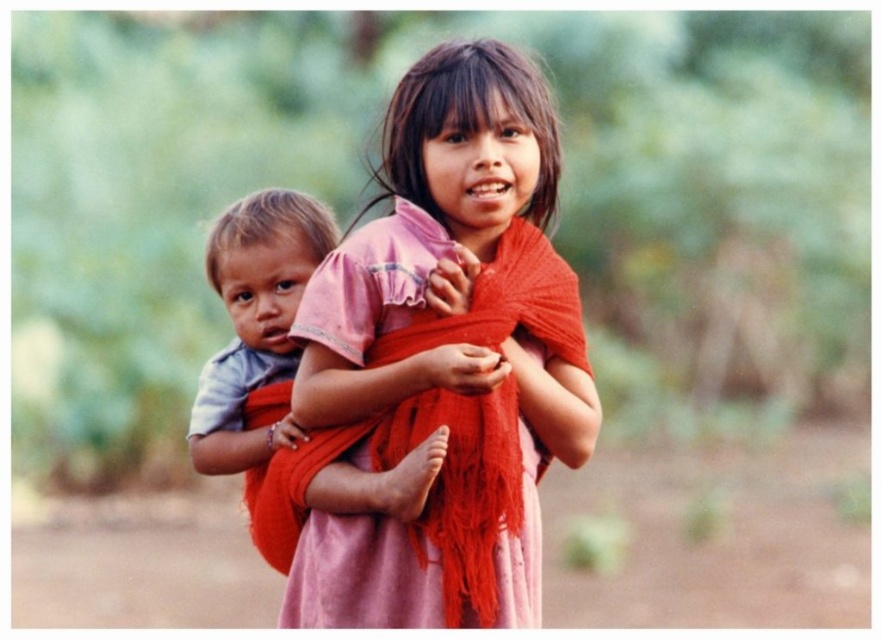
Question: Which point is farther to the camera?

Choices:
 (A) matte pink shirt at center
 (B) matte pink dress at center

Answer: (A)

Question: Among these objects, which one is nearest to the camera?

Choices:
 (A) matte pink dress at center
 (B) matte pink shirt at center

Answer: (A)

Question: Can you confirm if matte pink dress at center is positioned to the right of matte pink shirt at center?

Choices:
 (A) no
 (B) yes

Answer: (B)

Question: Which object appears farthest from the camera in this image?

Choices:
 (A) matte pink dress at center
 (B) matte pink shirt at center

Answer: (B)

Question: Does matte pink dress at center appear under matte pink shirt at center?

Choices:
 (A) no
 (B) yes

Answer: (A)

Question: Can you confirm if matte pink dress at center is bigger than matte pink shirt at center?

Choices:
 (A) yes
 (B) no

Answer: (A)